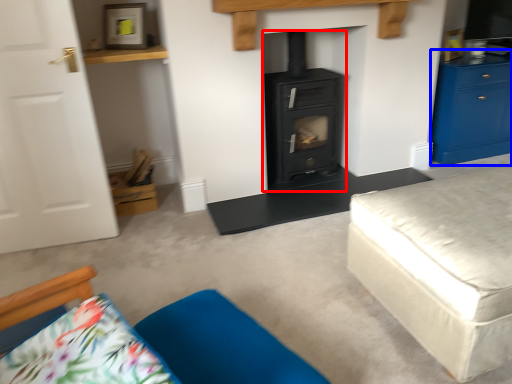
Question: Among these objects, which one is nearest to the camera, wood burning stove (highlighted by a red box) or chest of drawers (highlighted by a blue box)?

Choices:
 (A) wood burning stove
 (B) chest of drawers

Answer: (A)